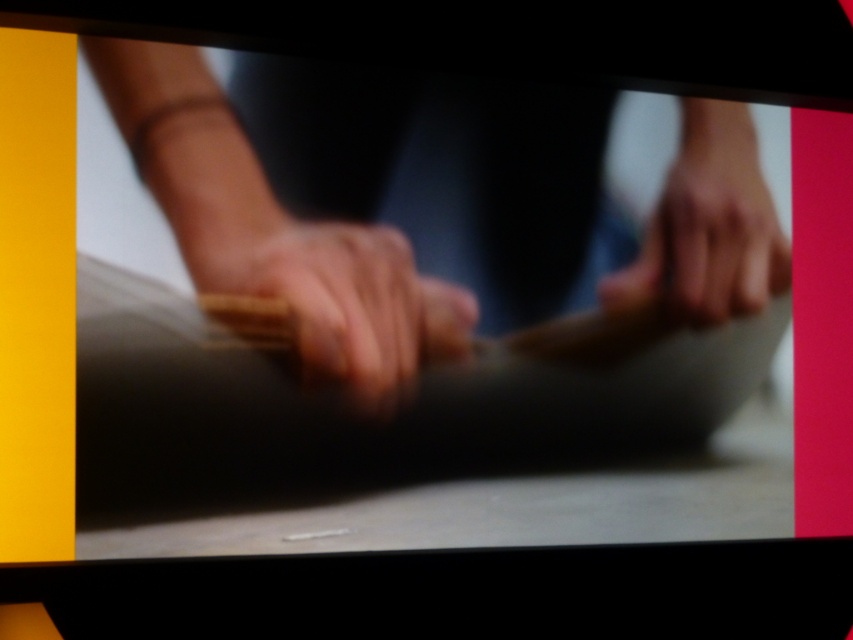
Question: Is smooth wood drumstick at center wider than smooth skin hand at center?

Choices:
 (A) no
 (B) yes

Answer: (B)

Question: Among these objects, which one is nearest to the camera?

Choices:
 (A) smooth skin hand at center
 (B) smooth wood drumstick at center
 (C) smooth beige fabric at center

Answer: (C)

Question: Which of the following is the closest to the observer?

Choices:
 (A) smooth skin hand at center
 (B) smooth wood drumstick at center

Answer: (B)

Question: Considering the real-world distances, which object is closest to the smooth skin hand at center?

Choices:
 (A) smooth beige fabric at center
 (B) smooth wood drumstick at center

Answer: (B)

Question: Can you confirm if smooth beige fabric at center is bigger than smooth wood drumstick at center?

Choices:
 (A) no
 (B) yes

Answer: (B)

Question: Does smooth beige fabric at center appear under smooth wood drumstick at center?

Choices:
 (A) yes
 (B) no

Answer: (B)